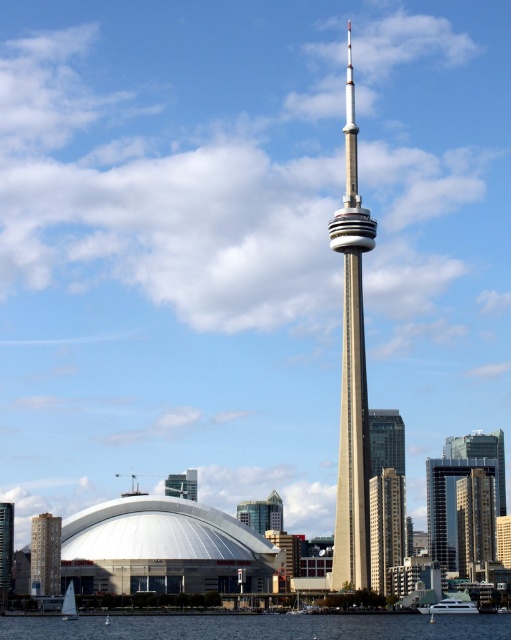
Question: Among these points, which one is nearest to the camera?

Choices:
 (A) (362, 224)
 (B) (58, 552)
 (C) (464, 605)

Answer: (B)

Question: Is transparent water at lower center above white glass tower at center?

Choices:
 (A) yes
 (B) no

Answer: (B)

Question: Which of the following is the closest to the observer?

Choices:
 (A) beige concrete building at center
 (B) transparent water at lower center
 (C) silver metallic spire at center

Answer: (B)

Question: Which of the following is the farthest from the observer?

Choices:
 (A) click(6, 532)
 (B) click(49, 561)
 (C) click(390, 557)
 (D) click(440, 461)

Answer: (D)

Question: Is beige concrete building at center thinner than white glossy boat at lower right?

Choices:
 (A) yes
 (B) no

Answer: (A)

Question: Where is transparent water at lower center located in relation to beige concrete building at center in the image?

Choices:
 (A) right
 (B) left

Answer: (B)